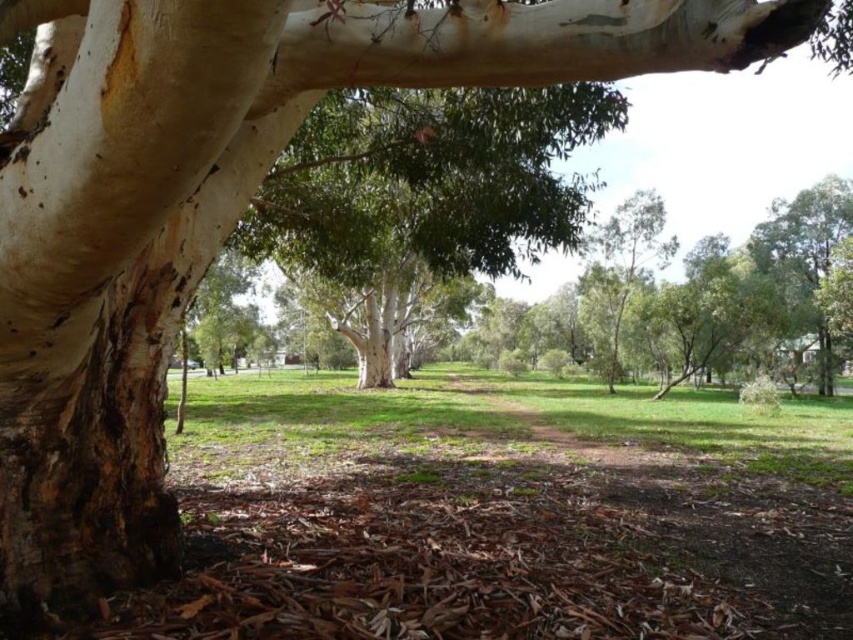
Is white rough bark tree trunk at left below green grass at center?

No.

Who is taller, white rough bark tree trunk at left or green grass at center?

green grass at center is taller.

What are the coordinates of `white rough bark tree trunk at left` in the screenshot? It's located at (108, 276).

Can you confirm if white rough bark tree trunk at left is smaller than green leafy tree at center?

Yes.

Is white rough bark tree trunk at left taller than green leafy tree at center?

No, white rough bark tree trunk at left is not taller than green leafy tree at center.

What do you see at coordinates (108, 276) in the screenshot? The width and height of the screenshot is (853, 640). I see `white rough bark tree trunk at left` at bounding box center [108, 276].

Where is `white rough bark tree trunk at left`? The width and height of the screenshot is (853, 640). white rough bark tree trunk at left is located at coordinates (108, 276).

Can you confirm if green leafy tree at center is positioned above green grass at center?

Yes.

Does green leafy tree at center appear under green grass at center?

No.

Is point (509, 252) closer to viewer compared to point (792, 452)?

That is True.

Locate an element on the screen. The height and width of the screenshot is (640, 853). green leafy tree at center is located at coordinates (x=424, y=193).